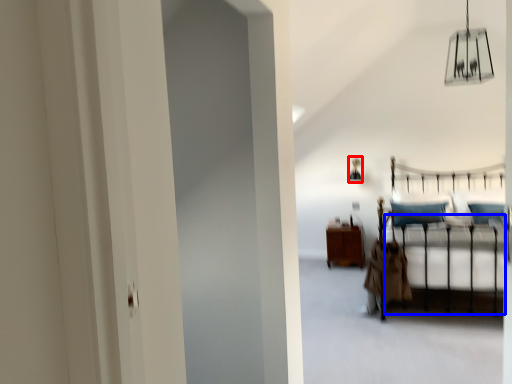
Question: Which object is further to the camera taking this photo, lamp (highlighted by a red box) or bed frame (highlighted by a blue box)?

Choices:
 (A) lamp
 (B) bed frame

Answer: (A)